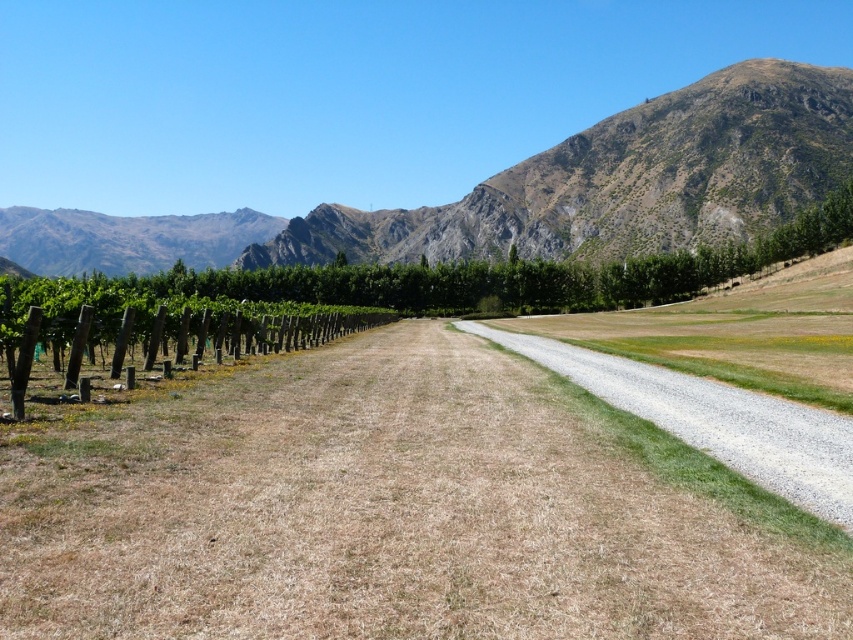
Question: Is brown grassy dirt track at center behind gravelly path at center?

Choices:
 (A) no
 (B) yes

Answer: (A)

Question: Does brown grassy dirt track at center have a smaller size compared to gravelly path at center?

Choices:
 (A) no
 (B) yes

Answer: (A)

Question: Which is farther from the brown grassy dirt track at center?

Choices:
 (A) gravelly path at center
 (B) rugged brown mountain at upper center

Answer: (B)

Question: Which point is closer to the camera taking this photo?

Choices:
 (A) (730, 440)
 (B) (25, 209)

Answer: (A)

Question: Which point is closer to the camera taking this photo?

Choices:
 (A) (757, 147)
 (B) (759, 483)
 (C) (804, 592)

Answer: (C)

Question: Is rugged brown mountain at upper center wider than gravelly path at center?

Choices:
 (A) yes
 (B) no

Answer: (A)